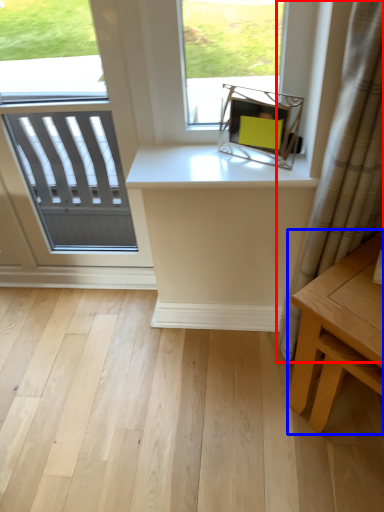
Question: Which of the following is the closest to the observer, curtain (highlighted by a red box) or table (highlighted by a blue box)?

Choices:
 (A) curtain
 (B) table

Answer: (A)